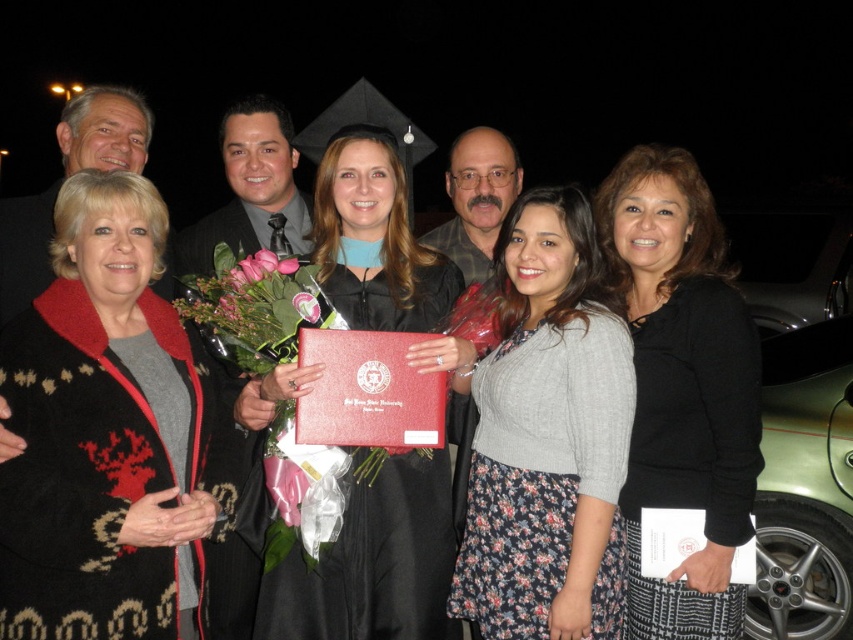
Who is taller, black sweater at center or matte black gown at center?

black sweater at center

In the scene shown: Between black sweater at center and matte black gown at center, which one is positioned higher?

black sweater at center

You are a GUI agent. You are given a task and a screenshot of the screen. Output one action in this format:
    pyautogui.click(x=<x>, y=<y>)
    Task: Click on the black sweater at center
    The height and width of the screenshot is (640, 853).
    Given the screenshot: What is the action you would take?
    pyautogui.click(x=682, y=387)

Is floral print dress at center in front of matte black gown at center?

That is True.

Is floral print dress at center shorter than matte black gown at center?

In fact, floral print dress at center may be taller than matte black gown at center.

At what (x,y) coordinates should I click in order to perform the action: click on floral print dress at center. Please return your answer as a coordinate pair (x, y). Looking at the image, I should click on (547, 440).

Between matte black gown at center and pink silk bouquet at center, which one has less height?

pink silk bouquet at center

Does point (277, 618) come closer to viewer compared to point (315, 305)?

No, it is behind (315, 305).

Where is `matte black gown at center`? matte black gown at center is located at coordinates (373, 563).